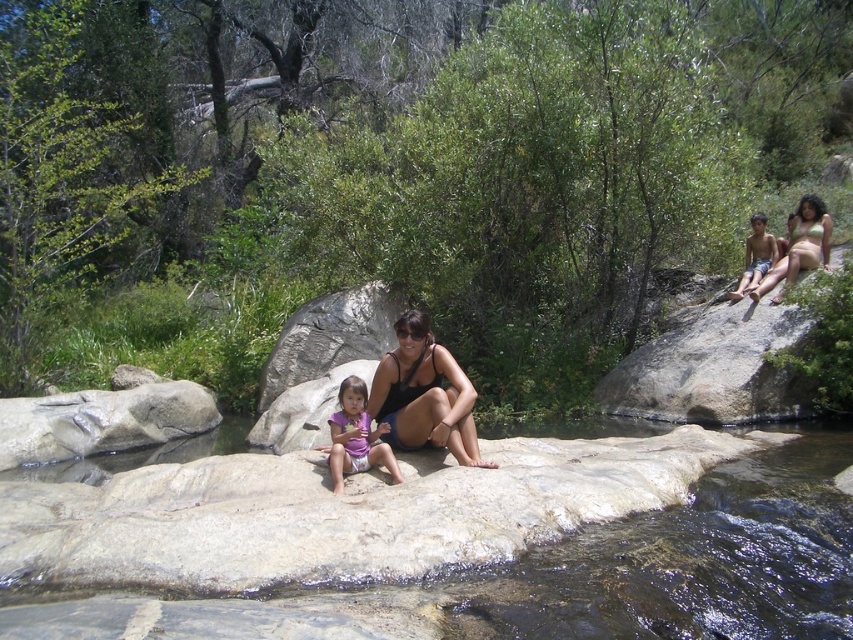
You are standing at the point with coordinates (424,394) in the image. What object is exactly at your location?

The matte black swimsuit at center is located at point (424,394).

You are a photographer trying to capture a group photo of the matte black bikini at center and the light brown skin at upper right. Which subject should you focus on first if you want to ensure both are in sharp focus?

The matte black bikini at center has a larger size compared to light brown skin at upper right, so you should focus on the matte black bikini at center first to ensure both are in sharp focus.

You are a photographer trying to capture a photo of the two adults in the scene. The adults are wearing matte black swimsuit at center and matte black bikini top at upper right. Which adult is positioned lower in the frame?

The matte black swimsuit at center is located below the matte black bikini top at upper right, so the adult wearing the matte black swimsuit at center is positioned lower in the frame.